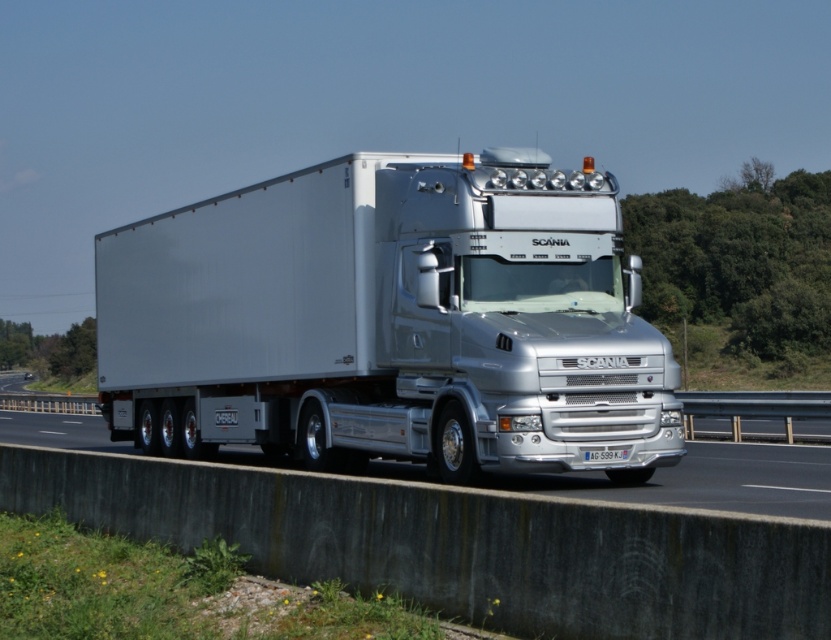
Based on the photo, you are a driver observing the silver metallic truck at center and the silver metallic highway at center. Which object is closer to you?

The silver metallic truck at center is closer to you because it is in front of the silver metallic highway at center.

Looking at this image, you are a photographer standing on the side of the highway. You want to take a photo of the silver metallic truck at center from a safe distance. The minimum safe distance for photographing moving vehicles is 30 feet. Can you take the photo without violating safety guidelines?

The silver metallic truck at center is 39.07 feet away from the camera. Since 39.07 feet is greater than the minimum safe distance of 30 feet, you can take the photo without violating safety guidelines.

You are a passenger in the silver metallic truck at center. You notice the silver metallic highway at center. From your perspective inside the truck, which side of the highway is the truck currently driving on?

The silver metallic truck at center is positioned on the right side of the silver metallic highway at center, so from inside the truck, the truck is driving on the right side of the highway.